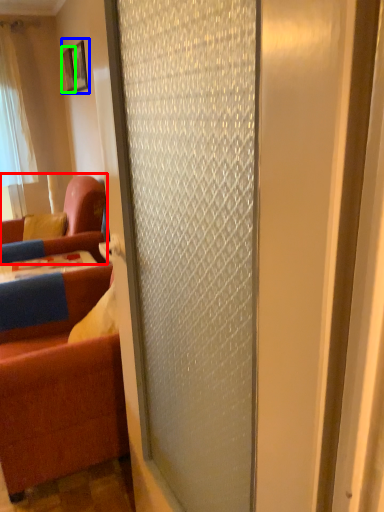
Question: Which object is positioned farthest from studio couch (highlighted by a red box)? Select from picture frame (highlighted by a blue box) and picture frame (highlighted by a green box).

Choices:
 (A) picture frame
 (B) picture frame

Answer: (B)